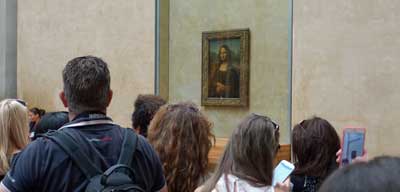
Where is `greenish colored wall`? The image size is (400, 192). greenish colored wall is located at coordinates (262, 22).